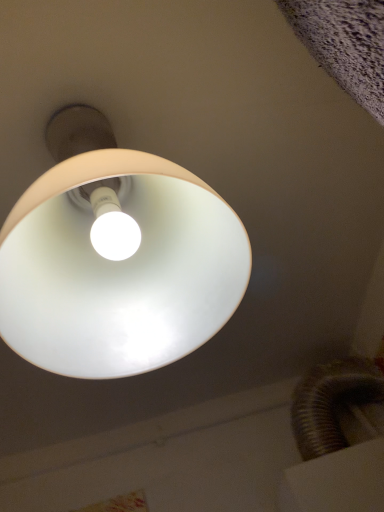
Locate an element on the screen. This screenshot has width=384, height=512. matte white lampshade at upper center is located at coordinates (116, 258).

What do you see at coordinates (116, 258) in the screenshot? This screenshot has height=512, width=384. I see `matte white lampshade at upper center` at bounding box center [116, 258].

The height and width of the screenshot is (512, 384). Find the location of `matte white lampshade at upper center`. matte white lampshade at upper center is located at coordinates (116, 258).